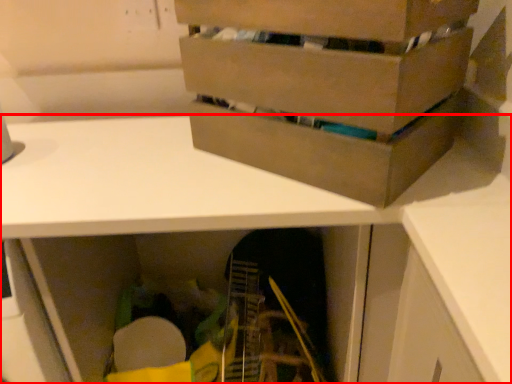
Question: Considering the relative positions of desk (annotated by the red box) and box in the image provided, where is desk (annotated by the red box) located with respect to the staircase?

Choices:
 (A) left
 (B) right

Answer: (A)